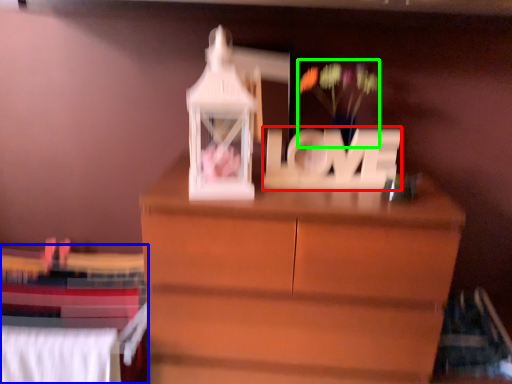
Question: Which object is the closest to the letter (highlighted by a red box)? Choose among these: bed (highlighted by a blue box) or floral arrangement (highlighted by a green box).

Choices:
 (A) bed
 (B) floral arrangement

Answer: (B)